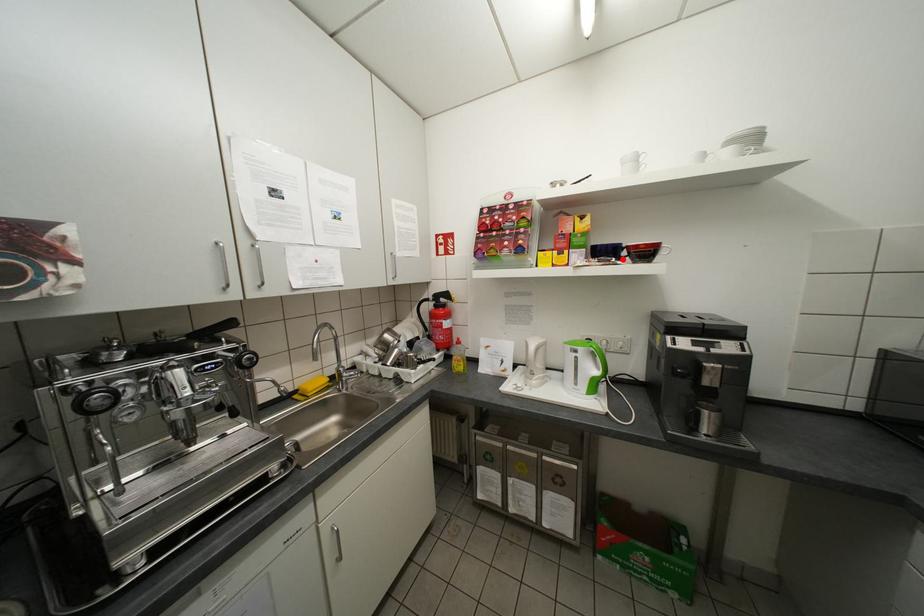
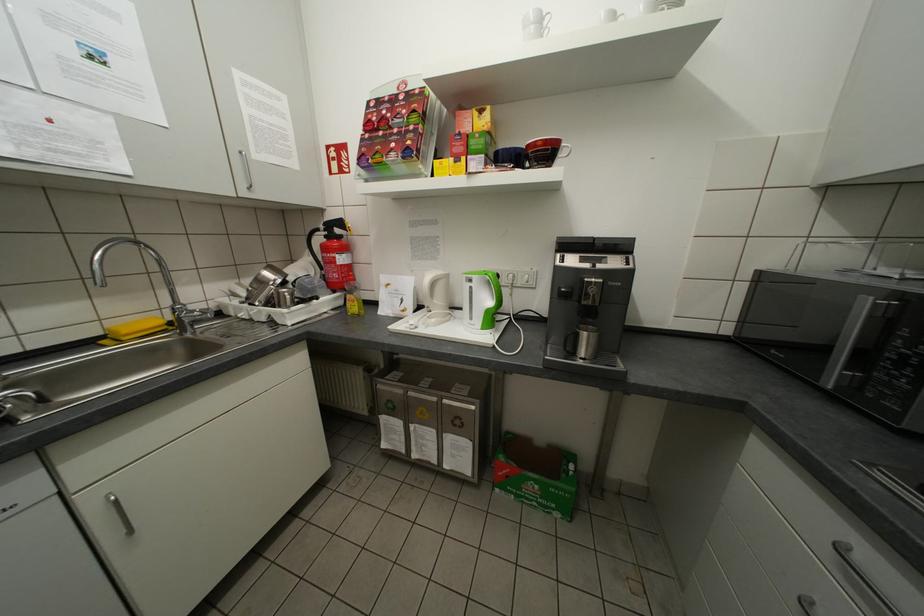
Question: I am providing you with two images of the same scene from different viewpoints. A red point is marked on the first image. Can you still see the location of the red point in image 2?

Choices:
 (A) Yes
 (B) No

Answer: (A)